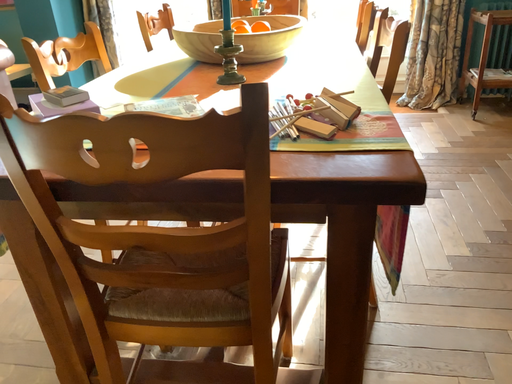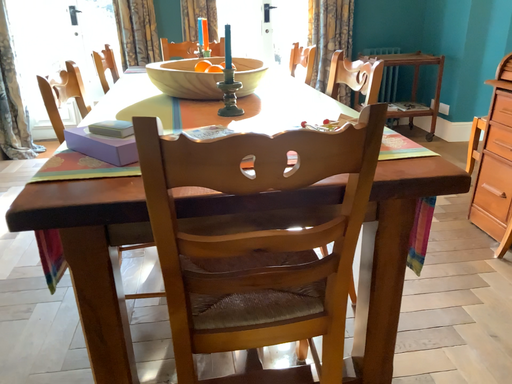
Question: Which way did the camera rotate in the video?

Choices:
 (A) rotated right
 (B) rotated left

Answer: (A)